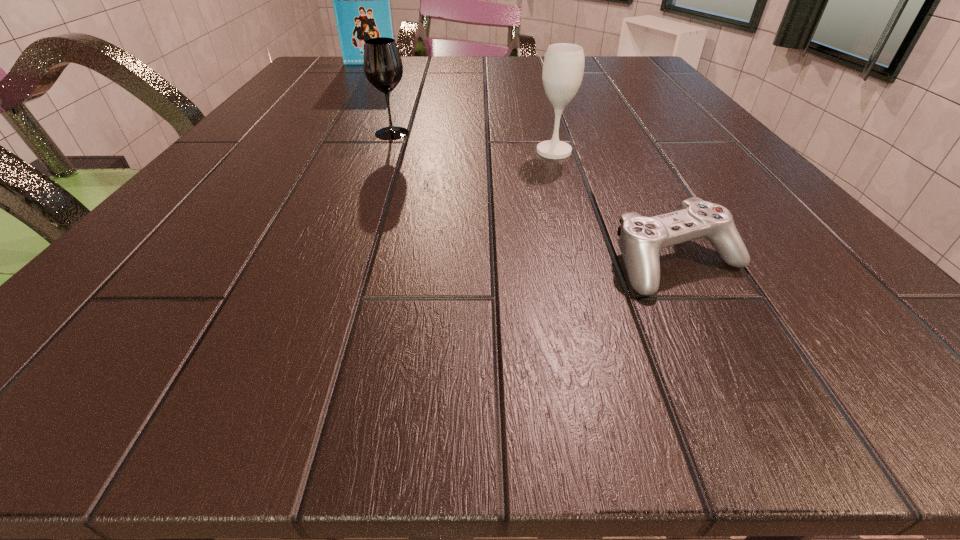
Identify the location of the leftmost object. The width and height of the screenshot is (960, 540). (361, 0).

Locate an element on the screen. This screenshot has width=960, height=540. book is located at coordinates (361, 0).

Find the location of a particular element. This screenshot has height=540, width=960. the right wineglass is located at coordinates (563, 67).

The height and width of the screenshot is (540, 960). I want to click on the nearer wineglass, so click(563, 67).

Where is `the second object from left to right`? The height and width of the screenshot is (540, 960). the second object from left to right is located at coordinates (383, 68).

The width and height of the screenshot is (960, 540). I want to click on the farther wineglass, so click(x=383, y=68).

Image resolution: width=960 pixels, height=540 pixels. I want to click on the rightmost object, so click(x=641, y=239).

Identify the location of the nearest object. The width and height of the screenshot is (960, 540). (641, 239).

Identify the location of vacant space located 0.060m on the front cover of the leftmost object. (366, 72).

At what (x,y) coordinates should I click in order to perform the action: click on free region located 0.290m on the left of the nearer wineglass. Please return your answer as a coordinate pair (x, y). Looking at the image, I should click on (372, 151).